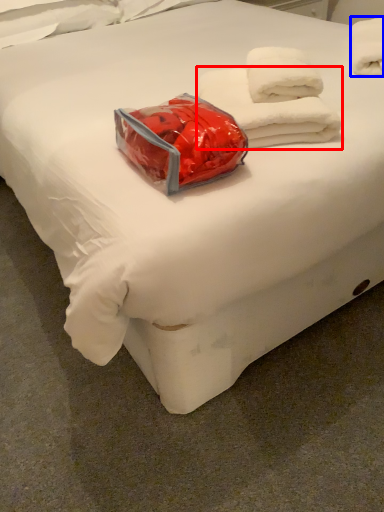
Question: Which object appears closest to the camera in this image, towel (highlighted by a red box) or towel (highlighted by a blue box)?

Choices:
 (A) towel
 (B) towel

Answer: (A)